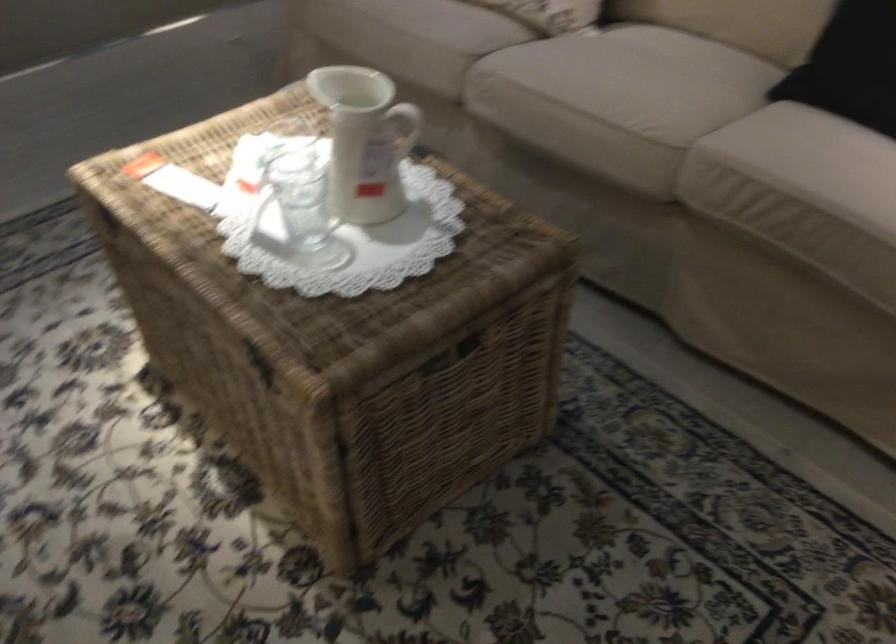
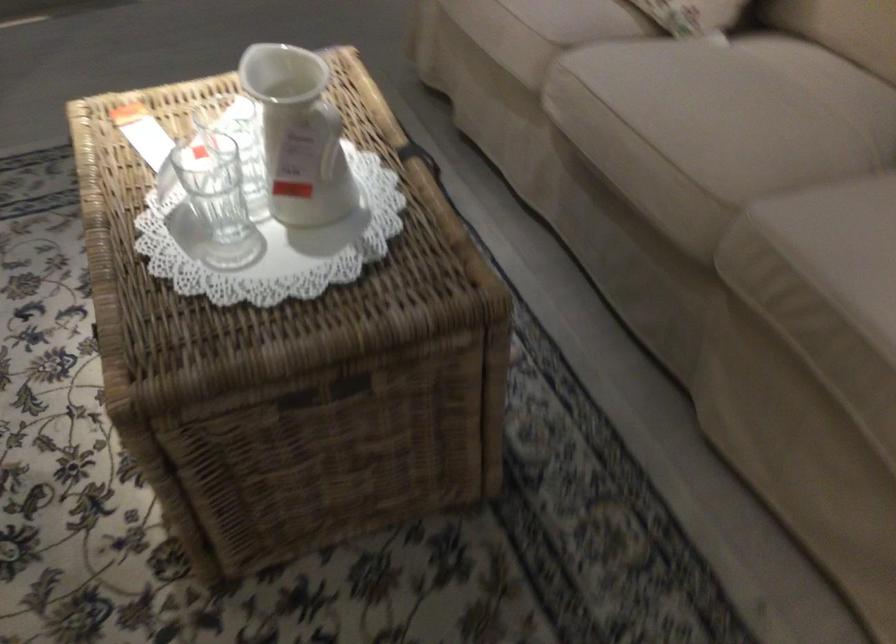
Which direction would the cameraman need to move to produce the second image?

The cameraman walked toward right, forward.